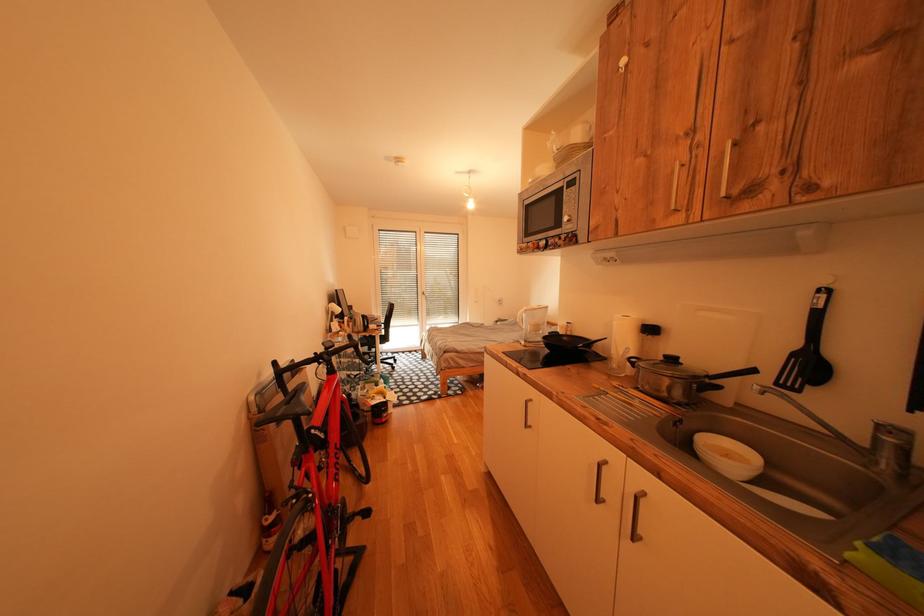
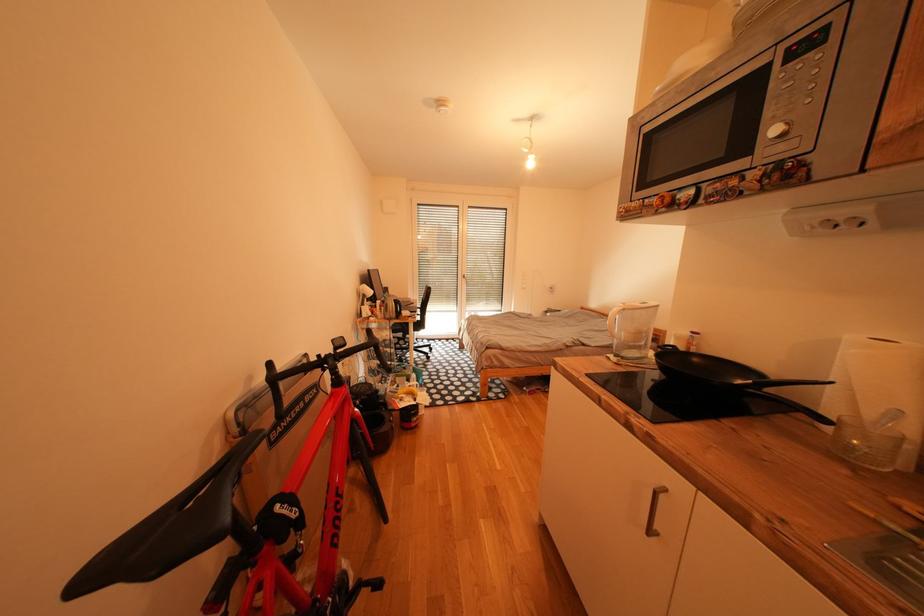
Question: The camera is either moving clockwise (left) or counter-clockwise (right) around the object. The first image is from the beginning of the video and the second image is from the end. Is the camera moving left or right when shooting the video?

Choices:
 (A) Left
 (B) Right

Answer: (B)